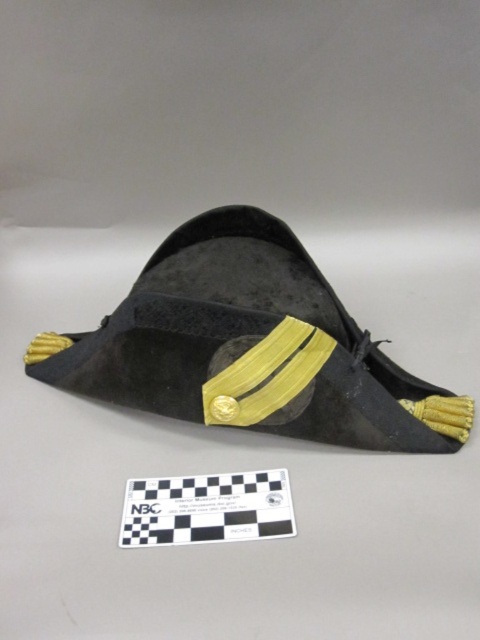
You are an interior designer arranging a historical exhibit. You have a velvet black tricorn hat at center and a black paper at center. Which object should you place in a display case that requires a larger item to fit properly?

The velvet black tricorn hat at center should be placed in the display case since it has a larger size compared to the black paper at center, making it suitable for the case requiring a larger item.

From the picture: You are an interior designer arranging items on a display shelf. You have a velvet black tricorn hat at center and a black paper at center. According to the image, which item is positioned to the right side of the shelf?

The velvet black tricorn hat at center is positioned to the right of the black paper at center, so the velvet black tricorn hat at center is on the right side of the shelf.